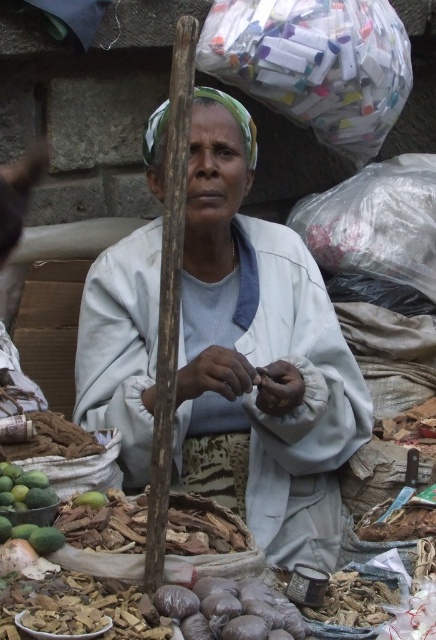
You are a customer at the market and want to pick up the white cloth at center and the green matte mangoes at lower left. Which item is closer to you?

The white cloth at center is closer to you because it is further to the viewer than the green matte mangoes at lower left.

You are standing in front of the woman at the market. You want to pick up an item from the ground. The first item is at point (313, 552) and the second item is at point (14, 486). Which item is closer to you?

Point (14, 486) is closer to you because it is less further to the camera than point (313, 552).